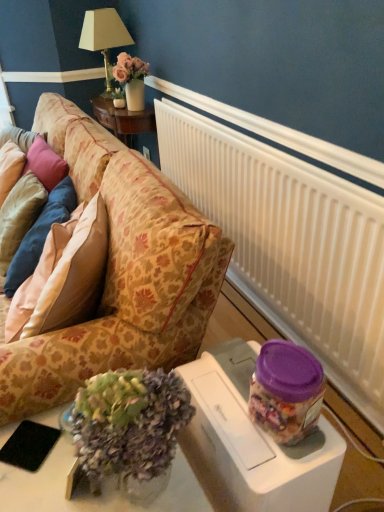
The height and width of the screenshot is (512, 384). I want to click on vacant space situated above translucent glass vase at lower center, the first table viewed from the left (from a real-world perspective), so click(x=61, y=468).